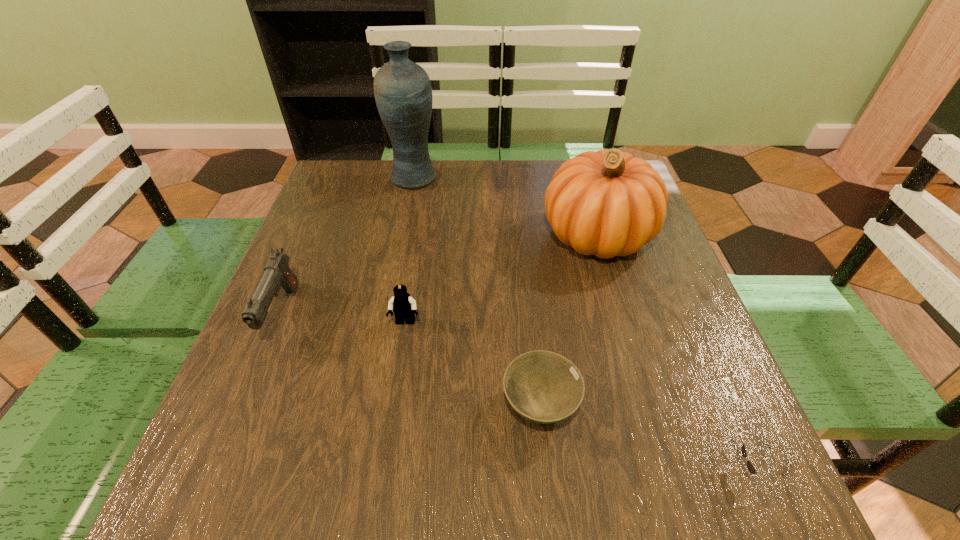
Identify the location of vacant space positioned on the front of the fifth shortest object. This screenshot has height=540, width=960. (623, 323).

I want to click on vacant area located 0.120m in the direction the gun is aimed, so click(x=242, y=412).

Where is `free space located on the front-facing side of the Lego`? Image resolution: width=960 pixels, height=540 pixels. free space located on the front-facing side of the Lego is located at coordinates (382, 468).

This screenshot has width=960, height=540. I want to click on vacant area situated 0.360m on the back of the bowl, so click(x=523, y=243).

Locate an element on the screen. Image resolution: width=960 pixels, height=540 pixels. free space located 0.400m in front of the lenses of the sunglasses is located at coordinates (473, 470).

Identify the location of vacant space located in front of the lenses of the sunglasses. This screenshot has height=540, width=960. (604, 470).

You are a GUI agent. You are given a task and a screenshot of the screen. Output one action in this format:
    pyautogui.click(x=<x>, y=<y>)
    Task: Click on the vacant space positioned 0.300m in front of the lenses of the sunglasses
    Image resolution: width=960 pixels, height=540 pixels.
    Given the screenshot: What is the action you would take?
    pyautogui.click(x=539, y=470)

You are a GUI agent. You are given a task and a screenshot of the screen. Output one action in this format:
    pyautogui.click(x=<x>, y=<y>)
    Task: Click on the vase present at the far edge
    
    Given the screenshot: What is the action you would take?
    pyautogui.click(x=402, y=89)

Locate an element on the screen. This screenshot has width=960, height=540. pumpkin located at the far edge is located at coordinates (607, 203).

Locate an element on the screen. This screenshot has width=960, height=540. object located at the near edge is located at coordinates pos(750,466).